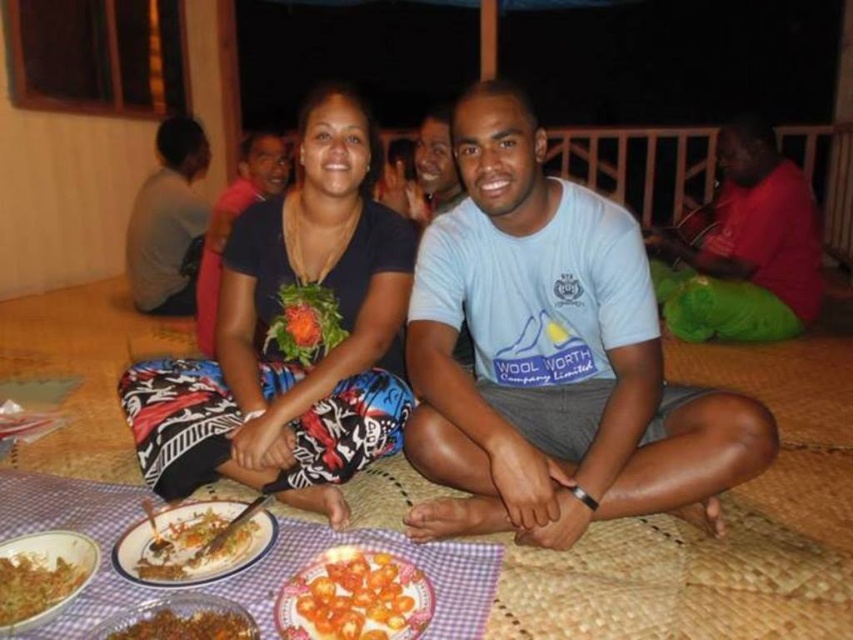
Which of these two, shiny brown rice at lower left or brown crumbly mix at lower left, stands taller?

shiny brown rice at lower left is taller.

Can you confirm if shiny brown rice at lower left is positioned above brown crumbly mix at lower left?

Indeed, shiny brown rice at lower left is positioned over brown crumbly mix at lower left.

Which is in front, point (10, 595) or point (125, 627)?

Positioned in front is point (125, 627).

Locate an element on the screen. shiny brown rice at lower left is located at coordinates (36, 584).

Does black printed shirt at center appear on the left side of gray fabric shirt at left?

Incorrect, black printed shirt at center is not on the left side of gray fabric shirt at left.

I want to click on black printed shirt at center, so click(292, 337).

Is the position of red cotton shirt at upper right less distant than that of matte black shirt at center?

No, it is behind matte black shirt at center.

Locate an element on the screen. red cotton shirt at upper right is located at coordinates (744, 250).

Where is `red cotton shirt at upper right`? red cotton shirt at upper right is located at coordinates (744, 250).